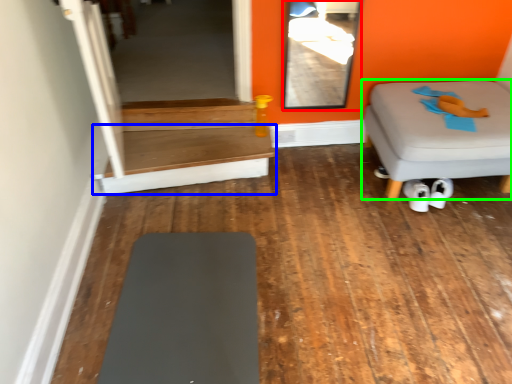
Question: Estimate the real-world distances between objects in this image. Which object is farther from glass door (highlighted by a red box), table (highlighted by a blue box) or furniture (highlighted by a green box)?

Choices:
 (A) table
 (B) furniture

Answer: (A)